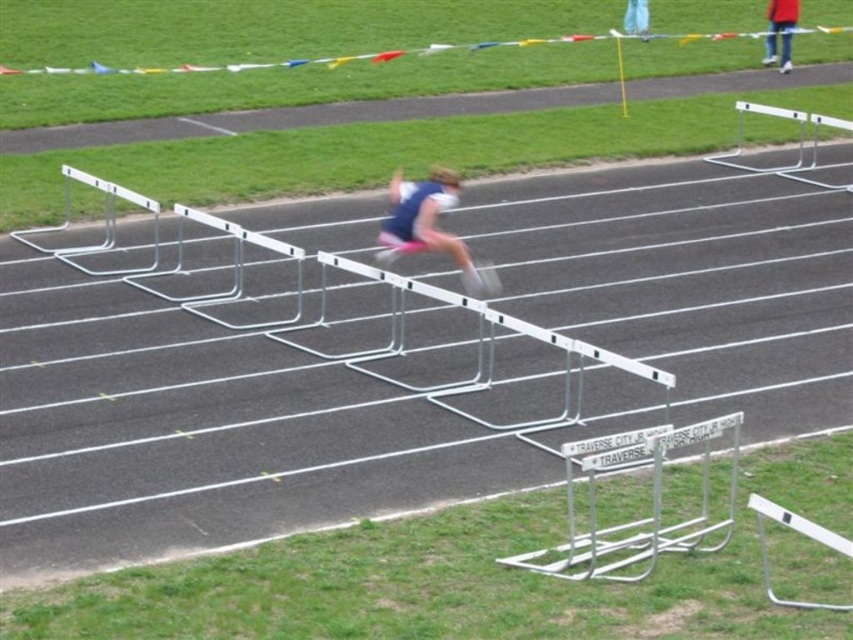
What do you see at coordinates (430, 227) in the screenshot? The width and height of the screenshot is (853, 640). I see `blue fabric athlete at center` at bounding box center [430, 227].

Which is behind, point (416, 205) or point (636, 3)?

Positioned behind is point (636, 3).

Where is `blue fabric athlete at center`? This screenshot has width=853, height=640. blue fabric athlete at center is located at coordinates (430, 227).

You are a GUI agent. You are given a task and a screenshot of the screen. Output one action in this format:
    pyautogui.click(x=<x>, y=<y>)
    Task: Click on the silver metallic hurdle at center
    This screenshot has height=640, width=853.
    Given the screenshot: What is the action you would take?
    pyautogui.click(x=645, y=502)

You are a GUI agent. You are given a task and a screenshot of the screen. Output one action in this format:
    pyautogui.click(x=<x>, y=<y>)
    Task: Click on the silver metallic hurdle at center
    
    Given the screenshot: What is the action you would take?
    pyautogui.click(x=645, y=502)

Who is positioned more to the right, blue fabric athlete at center or blue fabric shirt at upper right?

From the viewer's perspective, blue fabric shirt at upper right appears more on the right side.

I want to click on blue fabric athlete at center, so click(430, 227).